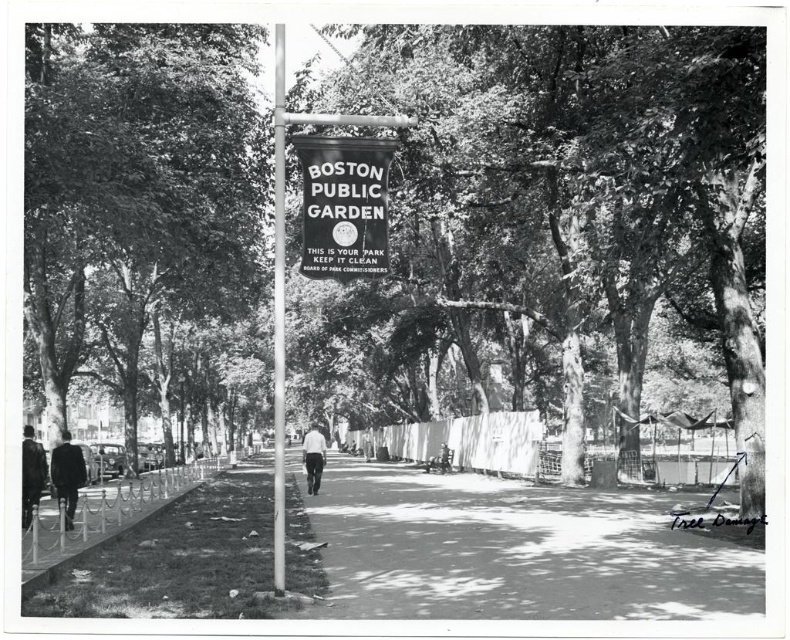
Question: Does matte black banner at center appear under smooth metal pole at center?

Choices:
 (A) yes
 (B) no

Answer: (A)

Question: Does smooth concrete pavement at lower center have a larger size compared to white cotton shirt at center?

Choices:
 (A) yes
 (B) no

Answer: (B)

Question: Is smooth bark tree at center bigger than smooth bark tree at left?

Choices:
 (A) yes
 (B) no

Answer: (A)

Question: Estimate the real-world distances between objects in this image. Which object is closer to the matte black banner at center?

Choices:
 (A) smooth metal pole at center
 (B) smooth bark tree at left
 (C) dark wool coat at lower left

Answer: (A)

Question: Which is nearer to the smooth bark tree at left?

Choices:
 (A) dark gray jacket at left
 (B) smooth metal pole at center
 (C) smooth concrete pavement at lower center

Answer: (B)

Question: Which object is closer to the camera taking this photo?

Choices:
 (A) dark wool coat at lower left
 (B) dark gray jacket at left

Answer: (B)